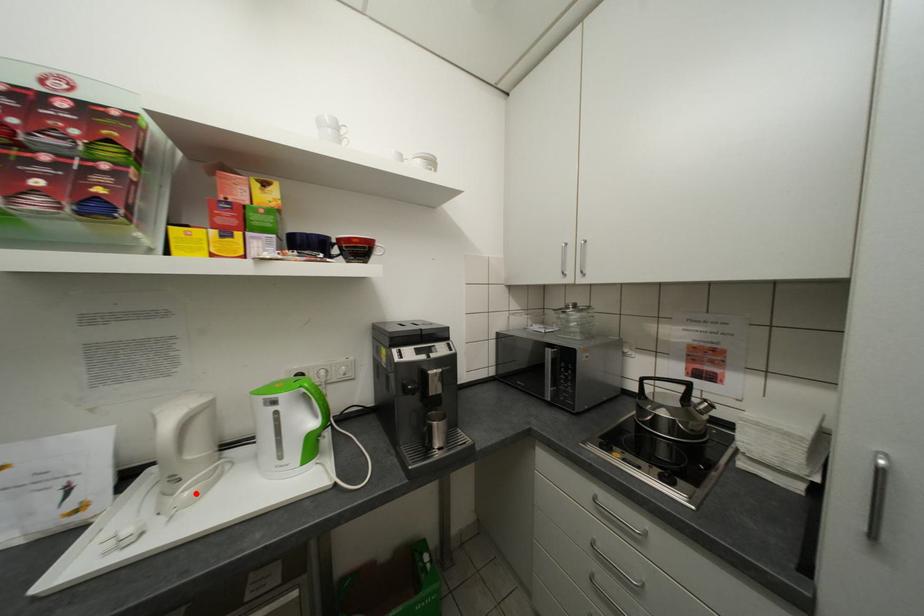
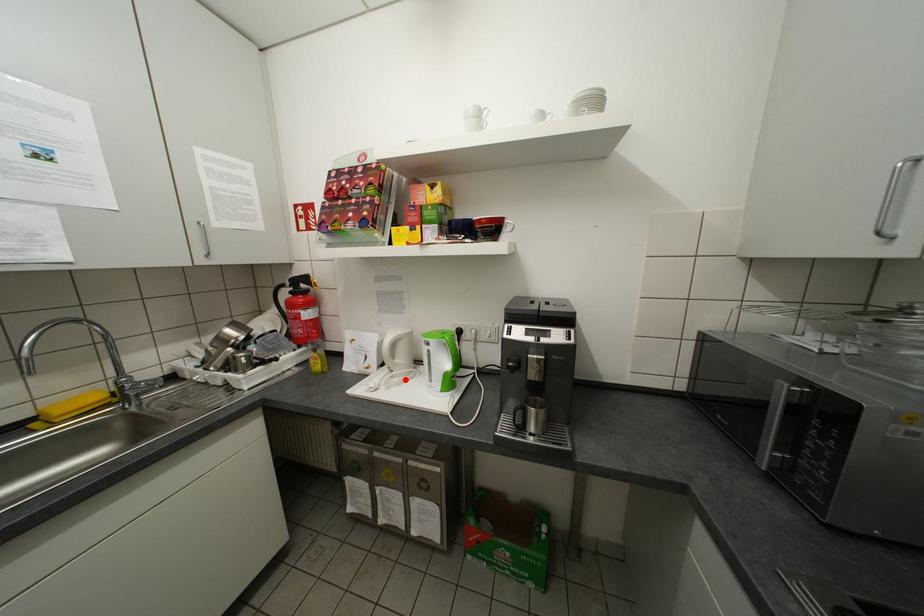
I am providing you with two images of the same scene from different viewpoints. A red point is marked on the first image and another point is marked on the second image. Is the marked point in image1 the same physical position as the marked point in image2?

Yes